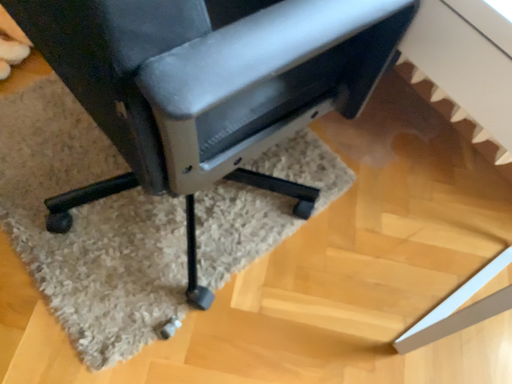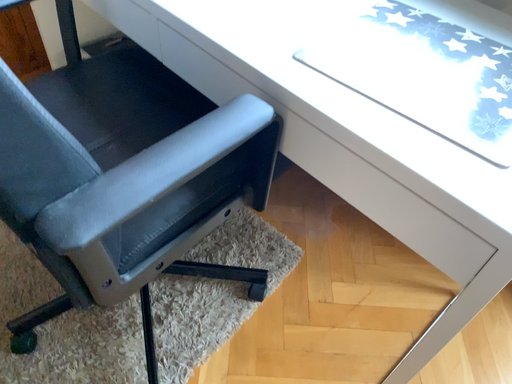
Question: How did the camera likely rotate when shooting the video?

Choices:
 (A) rotated downward
 (B) rotated upward

Answer: (B)